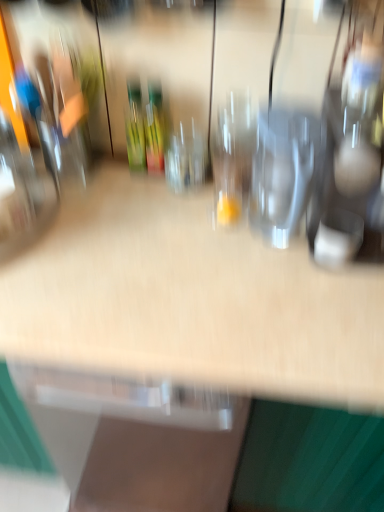
Question: Can you confirm if transparent glass at center, which appears as the second wine glass when viewed from the left, is smaller than transparent glass wine glass at center, which is the 3th wine glass from right to left?

Choices:
 (A) yes
 (B) no

Answer: (B)

Question: Can you confirm if transparent glass at center, the 2th wine glass positioned from the right, is shorter than transparent glass wine glass at center, which is the 3th wine glass from right to left?

Choices:
 (A) yes
 (B) no

Answer: (B)

Question: From a real-world perspective, is transparent glass at center, which appears as the second wine glass when viewed from the left, below transparent glass wine glass at center, which is the 3th wine glass from right to left?

Choices:
 (A) yes
 (B) no

Answer: (B)

Question: From the image's perspective, is transparent glass at center, which appears as the second wine glass when viewed from the left, above transparent glass wine glass at center, which is the 3th wine glass from right to left?

Choices:
 (A) no
 (B) yes

Answer: (A)

Question: From the image's perspective, does transparent glass at center, which appears as the second wine glass when viewed from the left, appear lower than transparent glass wine glass at center, which is the 3th wine glass from right to left?

Choices:
 (A) no
 (B) yes

Answer: (B)

Question: Is green glass bottle at center in front of or behind transparent glass wine glass at center, which appears as the first wine glass when viewed from the left, in the image?

Choices:
 (A) front
 (B) behind

Answer: (B)

Question: Is green glass bottle at center inside the boundaries of transparent glass wine glass at center, which is the 3th wine glass from right to left, or outside?

Choices:
 (A) inside
 (B) outside

Answer: (B)

Question: From a real-world perspective, relative to transparent glass wine glass at center, which is the 3th wine glass from right to left, is green glass bottle at center vertically above or below?

Choices:
 (A) below
 (B) above

Answer: (B)

Question: Is green glass bottle at center wider or thinner than transparent glass wine glass at center, which appears as the first wine glass when viewed from the left?

Choices:
 (A) wide
 (B) thin

Answer: (B)

Question: Relative to transparent glass at center, the 2th wine glass positioned from the right, is green glass bottle at center in front or behind?

Choices:
 (A) behind
 (B) front

Answer: (A)

Question: In terms of height, does green glass bottle at center look taller or shorter compared to transparent glass at center, which appears as the second wine glass when viewed from the left?

Choices:
 (A) short
 (B) tall

Answer: (B)

Question: Is green glass bottle at center bigger or smaller than transparent glass at center, the 2th wine glass positioned from the right?

Choices:
 (A) big
 (B) small

Answer: (B)

Question: From the image's perspective, is green glass bottle at center located above or below transparent glass at center, the 2th wine glass positioned from the right?

Choices:
 (A) above
 (B) below

Answer: (A)

Question: Is green glass bottle at center in front of or behind green glass wine bottle at center in the image?

Choices:
 (A) front
 (B) behind

Answer: (B)

Question: Is green glass bottle at center situated inside green glass wine bottle at center or outside?

Choices:
 (A) outside
 (B) inside

Answer: (A)